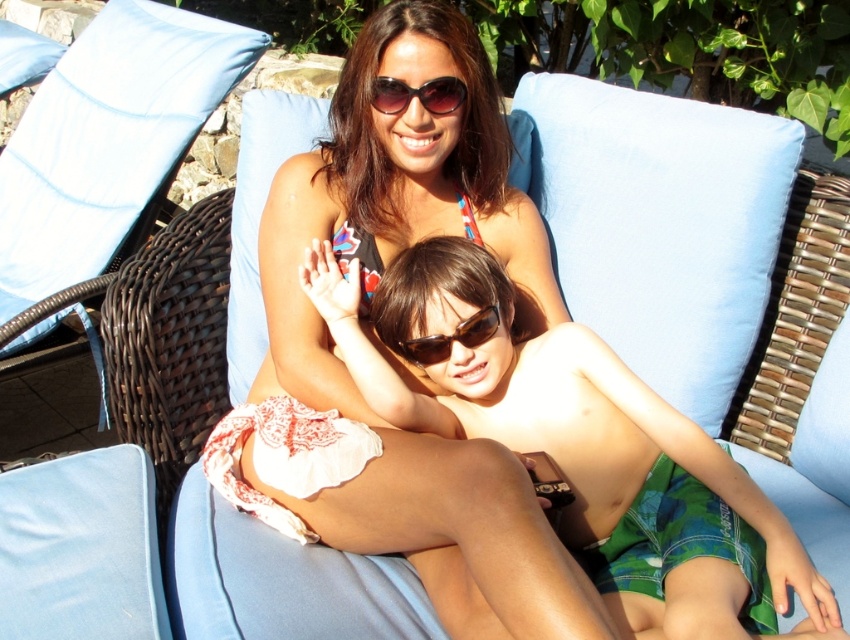
Question: Which object appears farthest from the camera in this image?

Choices:
 (A) printed fabric bikini at center
 (B) sunglasses at center
 (C) printed fabric bikini top at center
 (D) matte black bikini top at center

Answer: (C)

Question: In this image, where is sunglasses at center located relative to brown matte sunglasses at center?

Choices:
 (A) above
 (B) below

Answer: (A)

Question: Is matte black bikini top at center in front of brown matte sunglasses at center?

Choices:
 (A) yes
 (B) no

Answer: (A)

Question: Which point is farther to the camera?

Choices:
 (A) (438, 81)
 (B) (251, 432)
 (C) (434, 348)
 (D) (448, 596)

Answer: (B)

Question: In this image, where is matte black bikini top at center located relative to printed fabric bikini at center?

Choices:
 (A) right
 (B) left

Answer: (A)

Question: Among these points, which one is nearest to the camera?

Choices:
 (A) (282, 483)
 (B) (386, 61)

Answer: (A)